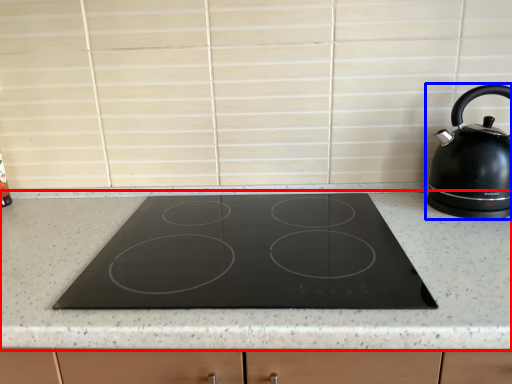
Question: Which object appears farthest to the camera in this image, countertop (highlighted by a red box) or kettle (highlighted by a blue box)?

Choices:
 (A) countertop
 (B) kettle

Answer: (B)